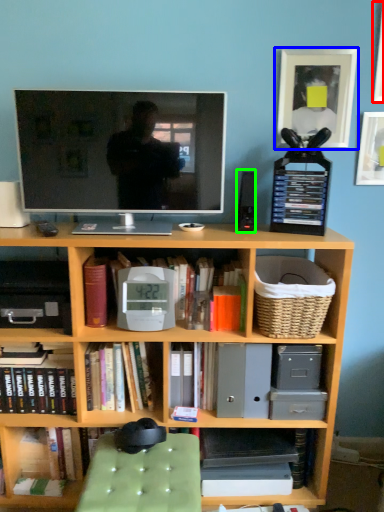
Question: Which object is the closest to the picture frame (highlighted by a red box)? Choose among these: picture frame (highlighted by a blue box) or speaker (highlighted by a green box).

Choices:
 (A) picture frame
 (B) speaker

Answer: (A)